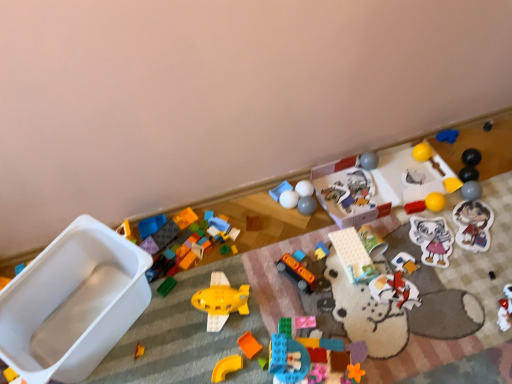
Where is `blank space to the left of white glossy sticker at center-right, arranged as the twentieth toy when viewed from the left`? The width and height of the screenshot is (512, 384). blank space to the left of white glossy sticker at center-right, arranged as the twentieth toy when viewed from the left is located at coordinates (393, 257).